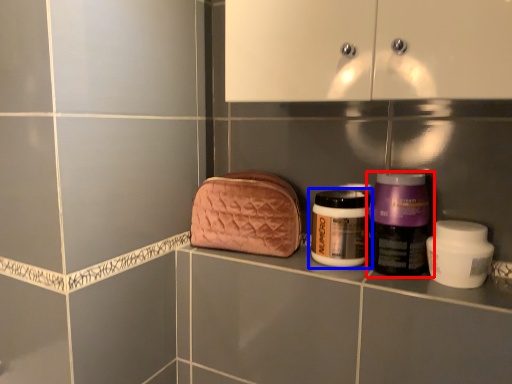
Question: Among these objects, which one is farthest to the camera, bottle (highlighted by a red box) or bottle (highlighted by a blue box)?

Choices:
 (A) bottle
 (B) bottle

Answer: (B)